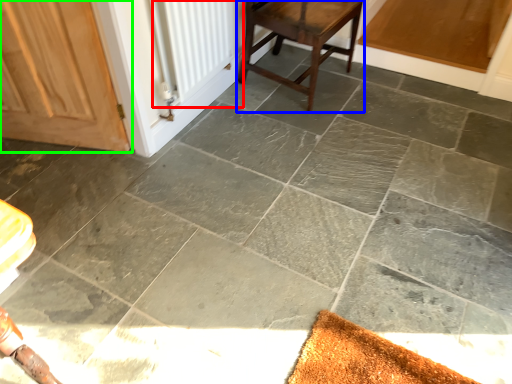
Question: Based on their relative distances, which object is nearer to radiator (highlighted by a red box)? Choose from stool (highlighted by a blue box) and door (highlighted by a green box).

Choices:
 (A) stool
 (B) door

Answer: (A)